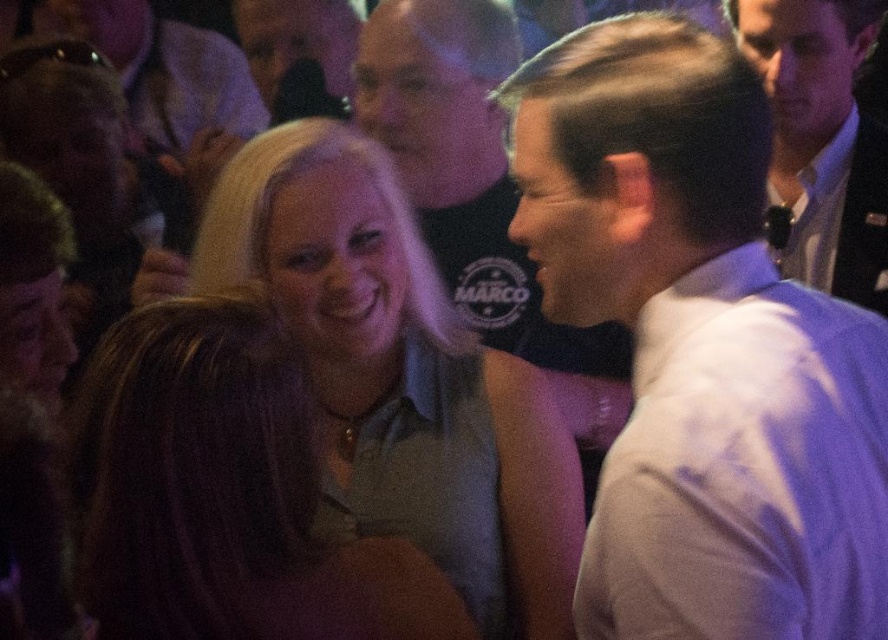
You are at the point marked as point (390, 360). What is the closest object to you?

The closest object to you at point (390, 360) is the light gray sleeveless top at center.

You are at a party and want to find the matte gray shirt at center. Based on the coordinates provided, can you confirm if the point marked at (223,493) is the correct location for the matte gray shirt at center?

Yes, the point marked at (223,493) corresponds to the matte gray shirt at center as per the coordinates provided.